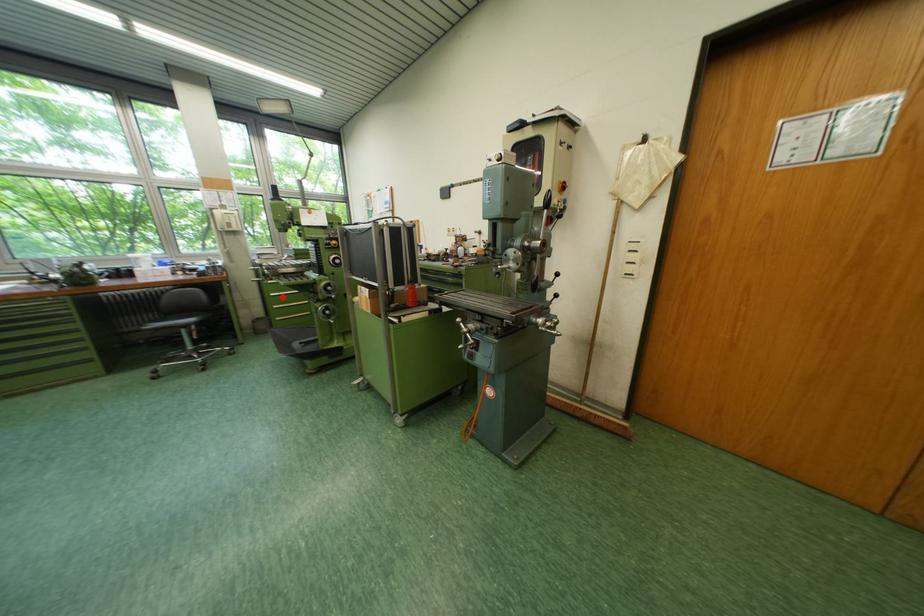
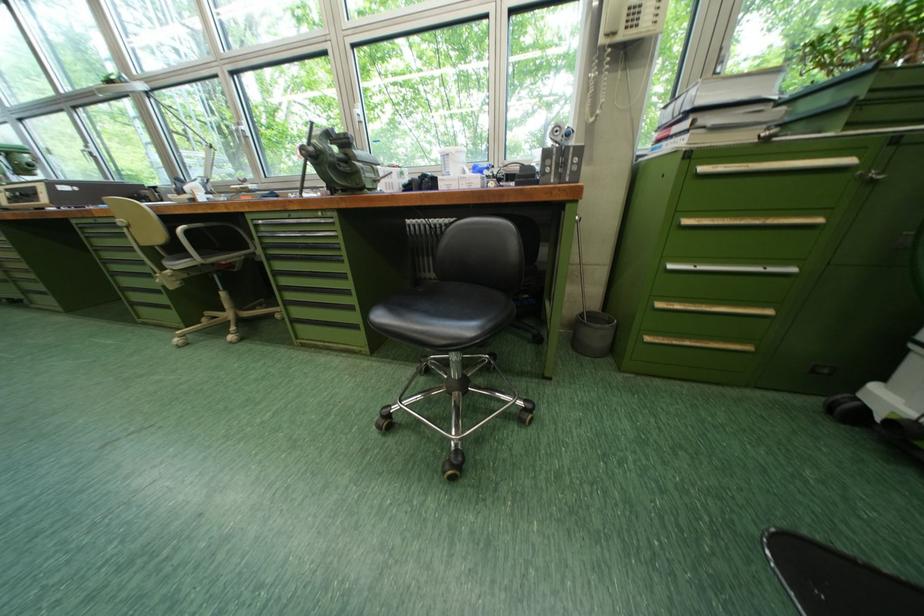
Where in the second image is the point corresponding to the highlighted location from the first image?

(681, 269)